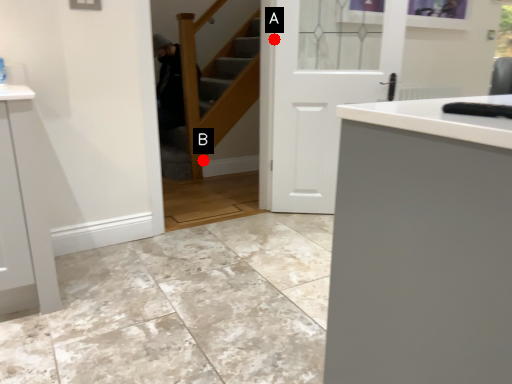
Question: Two points are circled on the image, labeled by A and B beside each circle. Which point is farther from the camera taking this photo?

Choices:
 (A) A is further
 (B) B is further

Answer: (B)